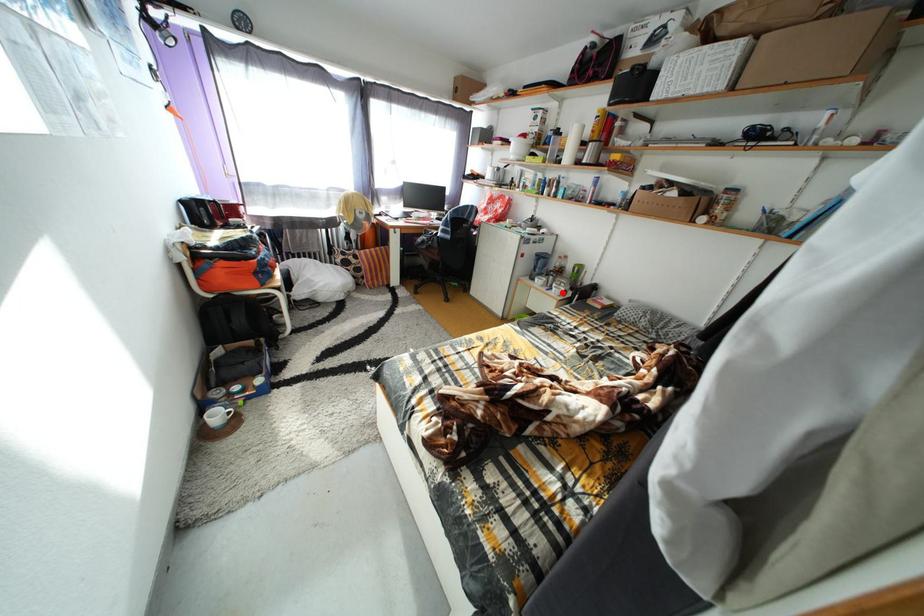
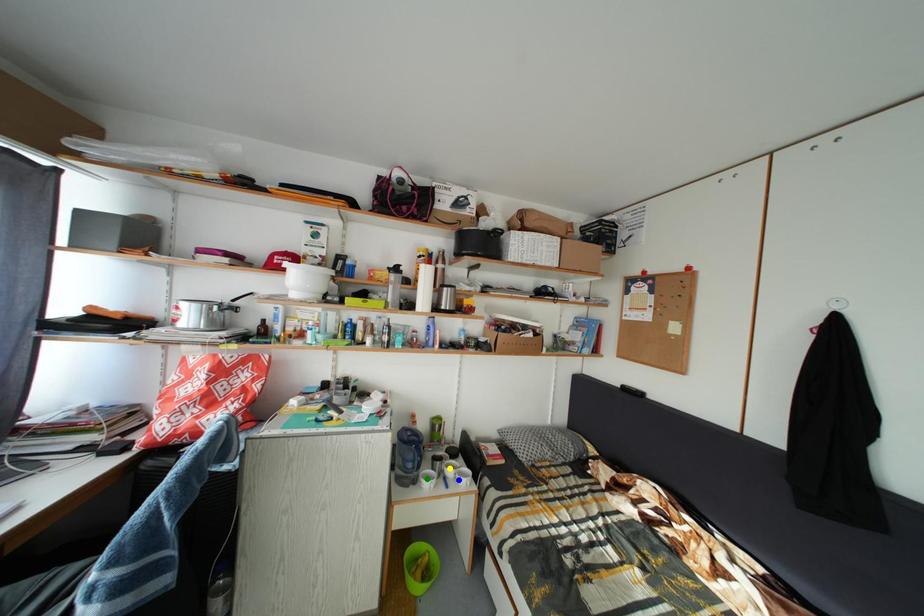
Question: I am providing you with two images of the same scene from different viewpoints. A red point is marked on the first image. You are given multiple points on the second image. In image 2, which mark is for the same physical point as the one in image 1?

Choices:
 (A) yellow point
 (B) green point
 (C) blue point

Answer: (C)